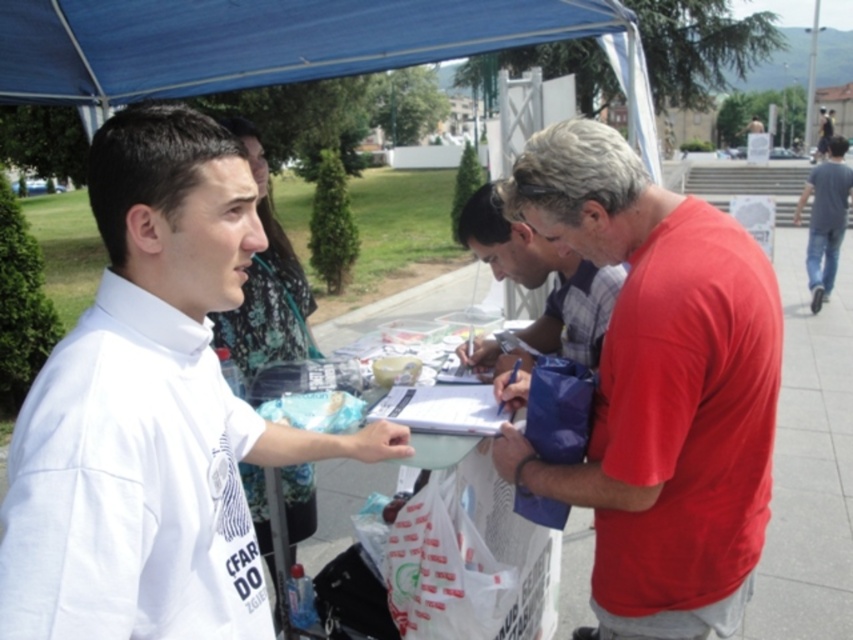
Between white cotton shirt at center and matte red shirt at center, which one has less height?

matte red shirt at center

Can you confirm if white cotton shirt at center is taller than matte red shirt at center?

Yes.

Identify the location of white cotton shirt at center. (151, 410).

The image size is (853, 640). Identify the location of white cotton shirt at center. (151, 410).

Is point (747, 500) closer to camera compared to point (843, 211)?

Yes.

Measure the distance between matte red t-shirt at right and camera.

matte red t-shirt at right is 4.29 feet from camera.

Who is more distant from viewer, [718,384] or [828,236]?

Point [828,236]

Where is `matte red t-shirt at right`? matte red t-shirt at right is located at coordinates (659, 388).

Is matte red shirt at center shorter than blue jeans at right?

Correct, matte red shirt at center is not as tall as blue jeans at right.

Is matte red shirt at center to the left of blue jeans at right from the viewer's perspective?

Yes, matte red shirt at center is to the left of blue jeans at right.

Between point (466, 204) and point (816, 252), which one is positioned behind?

Positioned behind is point (816, 252).

Where is `matte red shirt at center`? This screenshot has height=640, width=853. matte red shirt at center is located at coordinates (543, 278).